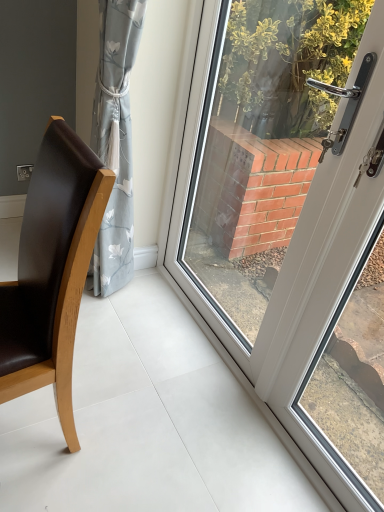
The image size is (384, 512). I want to click on free spot to the left of white glossy door at center, so click(x=159, y=353).